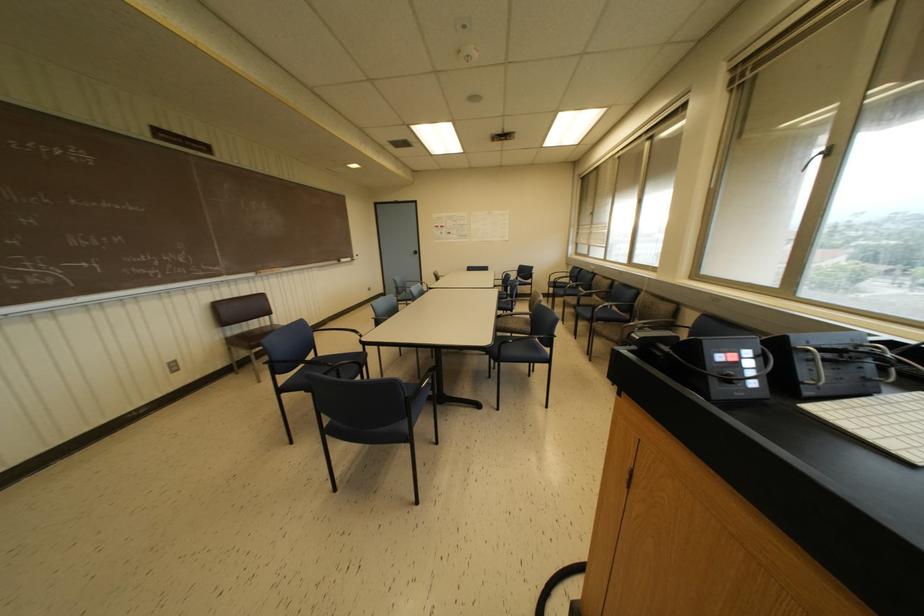
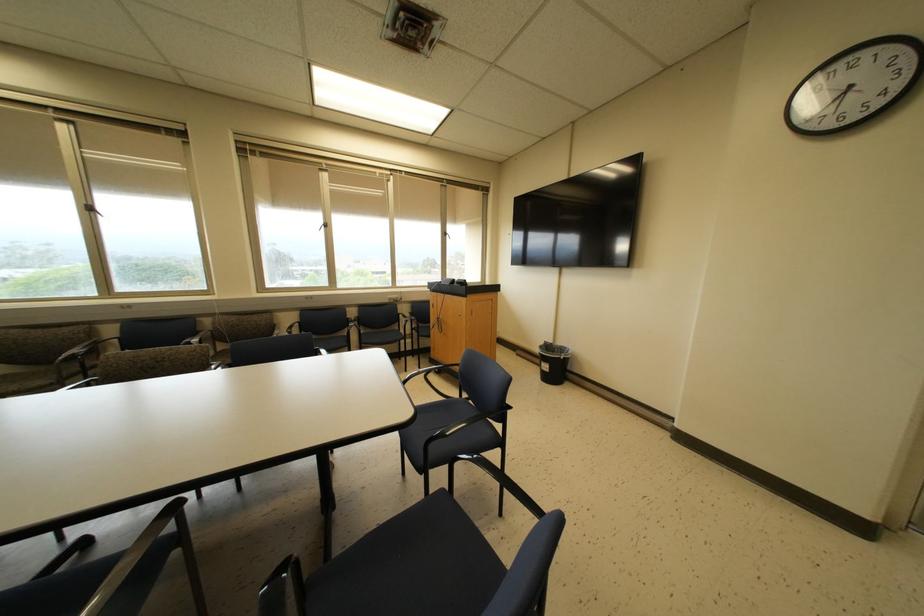
In the second image, find the point that corresponds to [639,201] in the first image.

(89, 208)